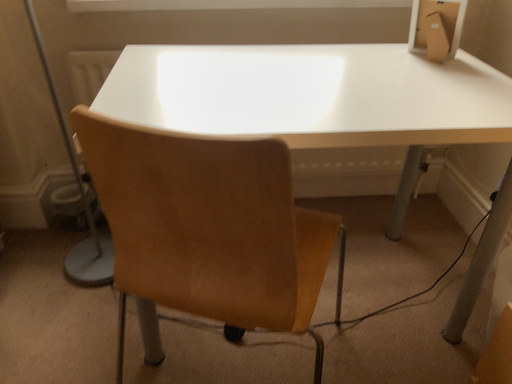
Locate an element on the screen. free space above white glossy table at center (from a real-world perspective) is located at coordinates (333, 85).